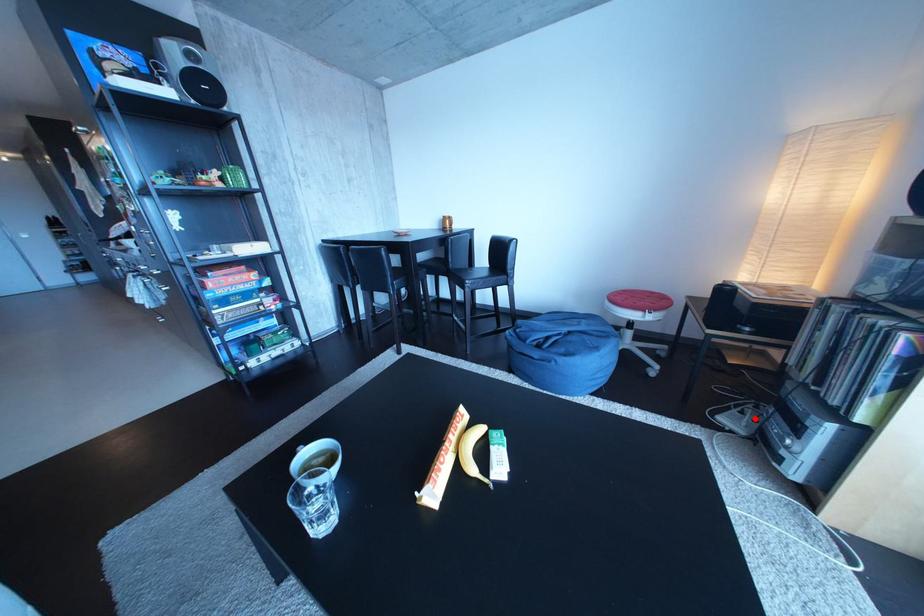
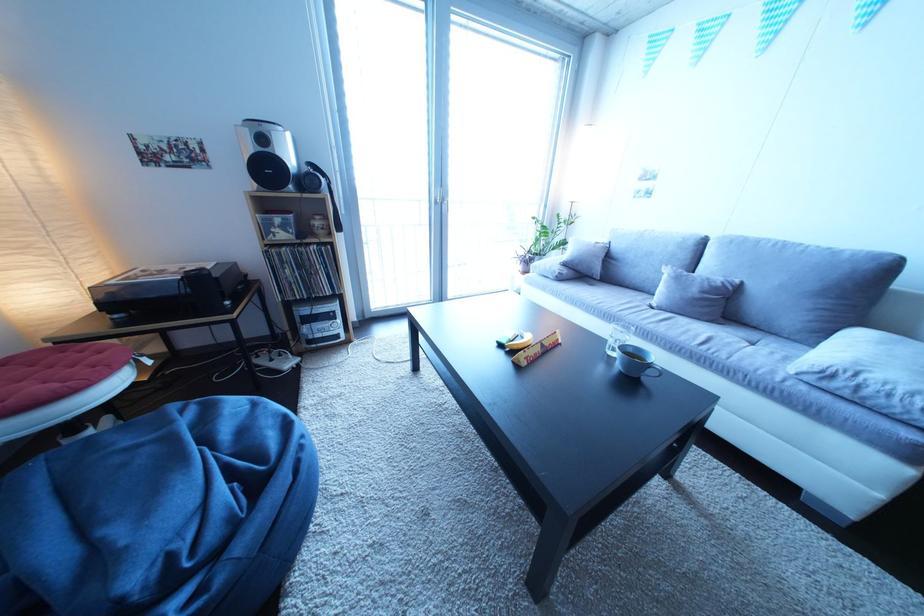
Question: I am providing you with two images of the same scene from different viewpoints. In image1, a red point is highlighted. Considering the same 3D point in image2, which of the following is correct?

Choices:
 (A) It is closer
 (B) It is farther

Answer: (B)